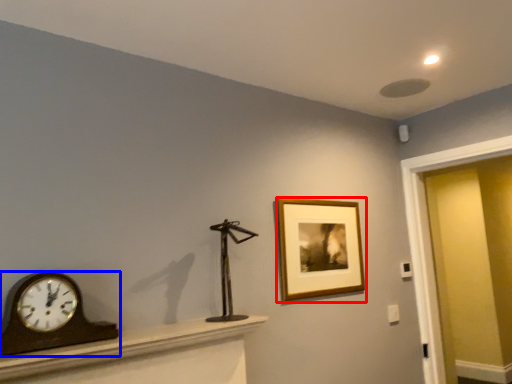
Question: Which object appears farthest to the camera in this image, picture frame (highlighted by a red box) or wall clock (highlighted by a blue box)?

Choices:
 (A) picture frame
 (B) wall clock

Answer: (A)